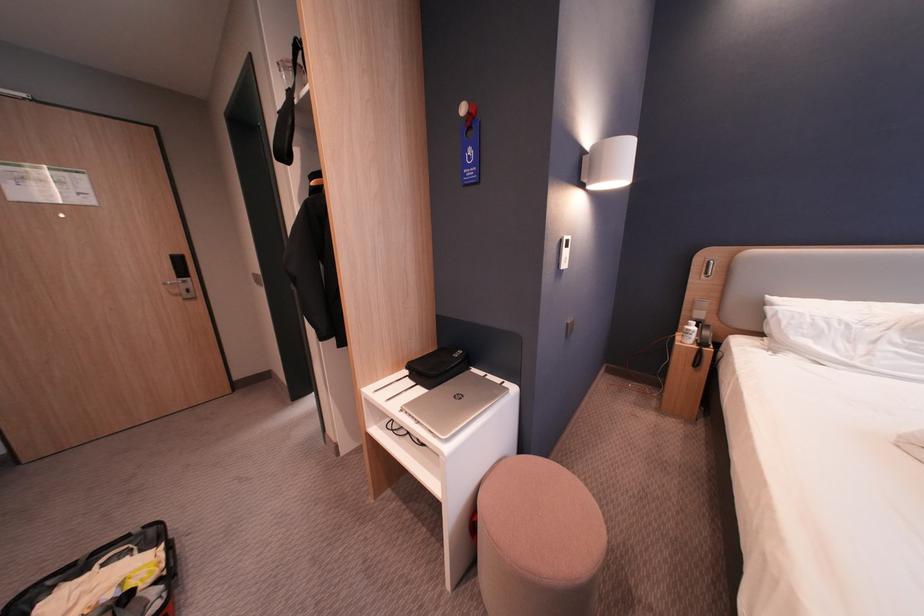
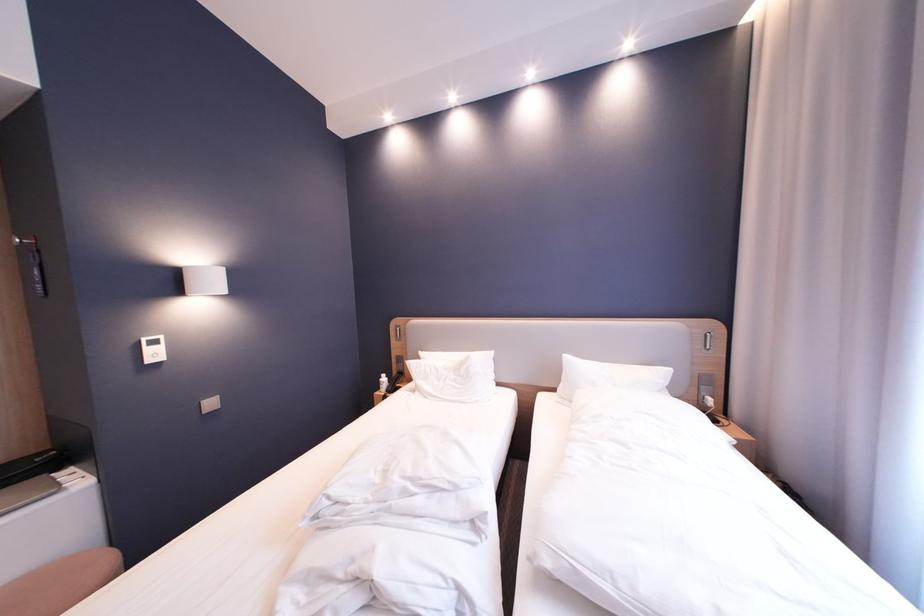
Locate, in the second image, the point that corresponds to pixel 569 240 in the first image.

(148, 341)